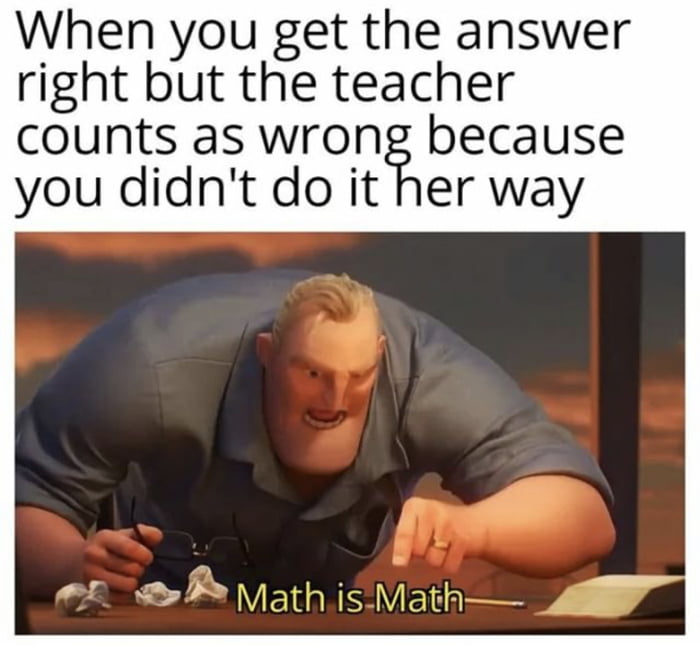
Locate an element on the screen. This screenshot has height=645, width=700. chest is located at coordinates (216, 495), (316, 515).